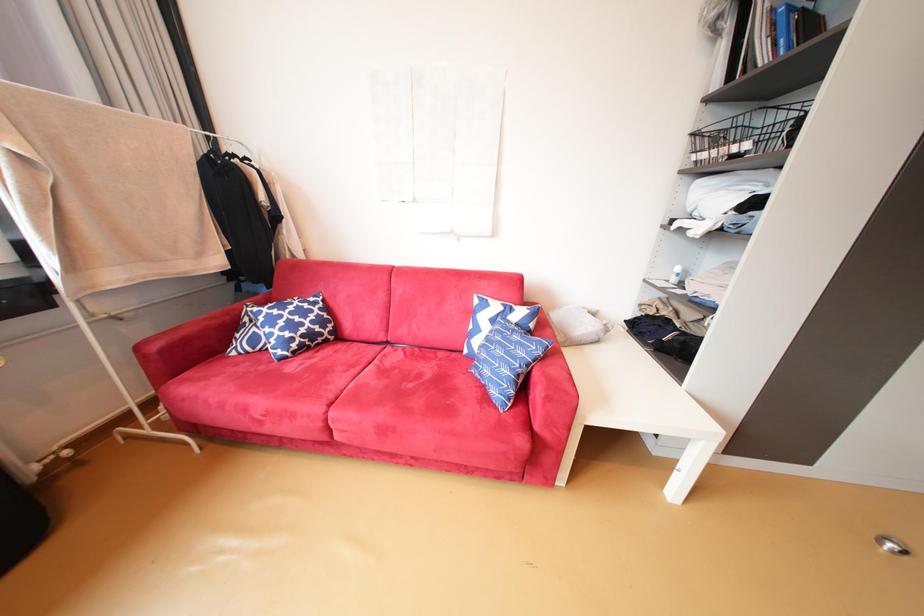
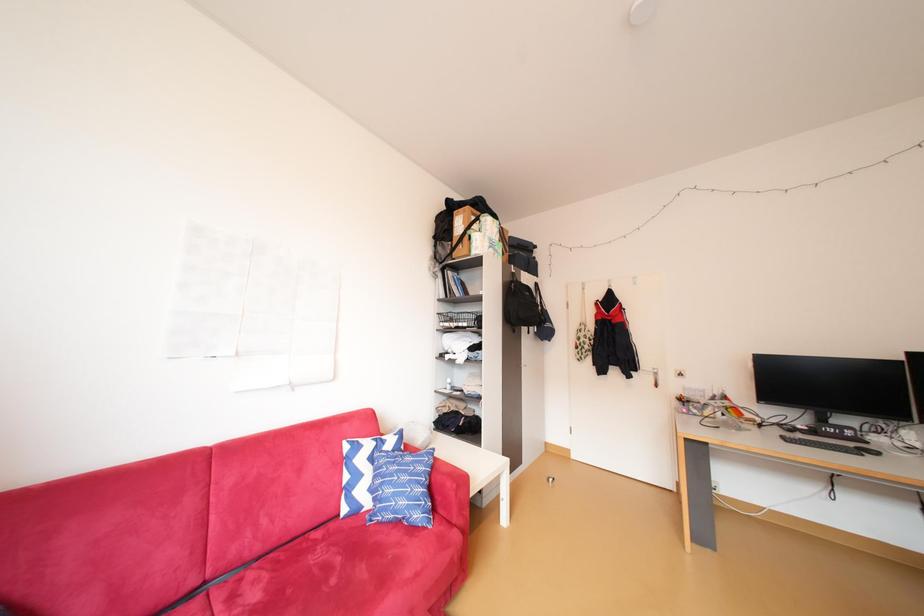
Based on the continuous images, in which direction is the camera rotating?

The rotation direction of the camera is right-up.